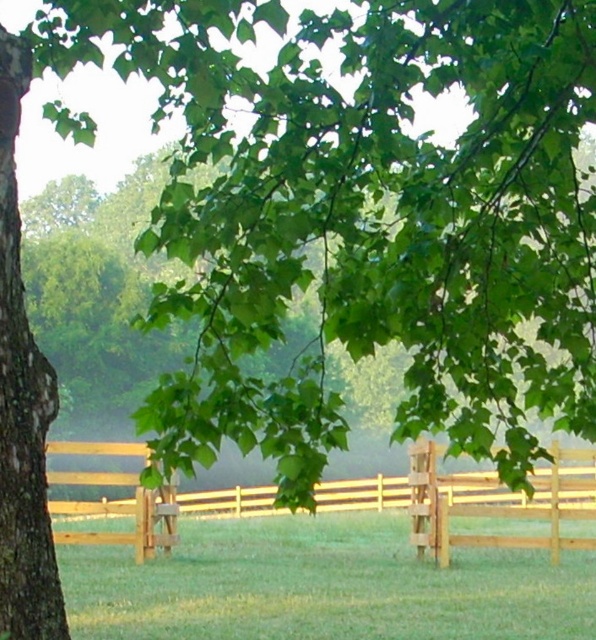
Question: Is light brown wooden fence at center behind brown wooden fence at lower right?

Choices:
 (A) yes
 (B) no

Answer: (B)

Question: Which of the following is the closest to the observer?

Choices:
 (A) (560, 456)
 (B) (566, 458)

Answer: (A)

Question: Which point is farther to the camera?

Choices:
 (A) brown wooden fence at lower right
 (B) light brown wooden fence at center

Answer: (A)

Question: Does light brown wooden fence at center appear over brown wooden fence at lower right?

Choices:
 (A) no
 (B) yes

Answer: (A)

Question: Can you confirm if light brown wooden fence at center is positioned above brown wooden fence at lower right?

Choices:
 (A) no
 (B) yes

Answer: (A)